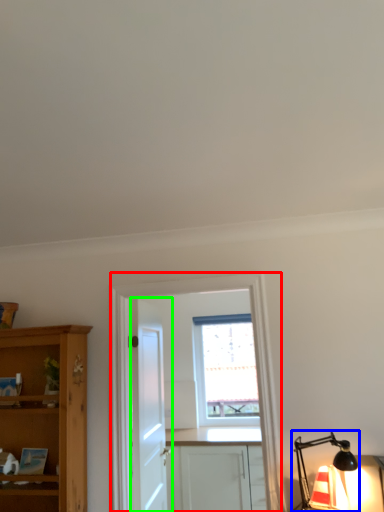
Question: Considering the real-world distances, which object is closest to entertainment center (highlighted by a red box)? light fixture (highlighted by a blue box) or door (highlighted by a green box).

Choices:
 (A) light fixture
 (B) door

Answer: (A)